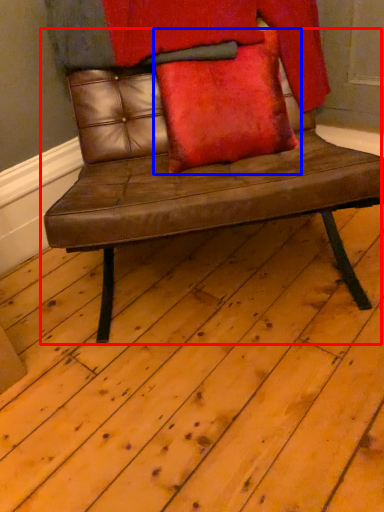
Question: Which object is closer to the camera taking this photo, chair (highlighted by a red box) or pillow (highlighted by a blue box)?

Choices:
 (A) chair
 (B) pillow

Answer: (A)